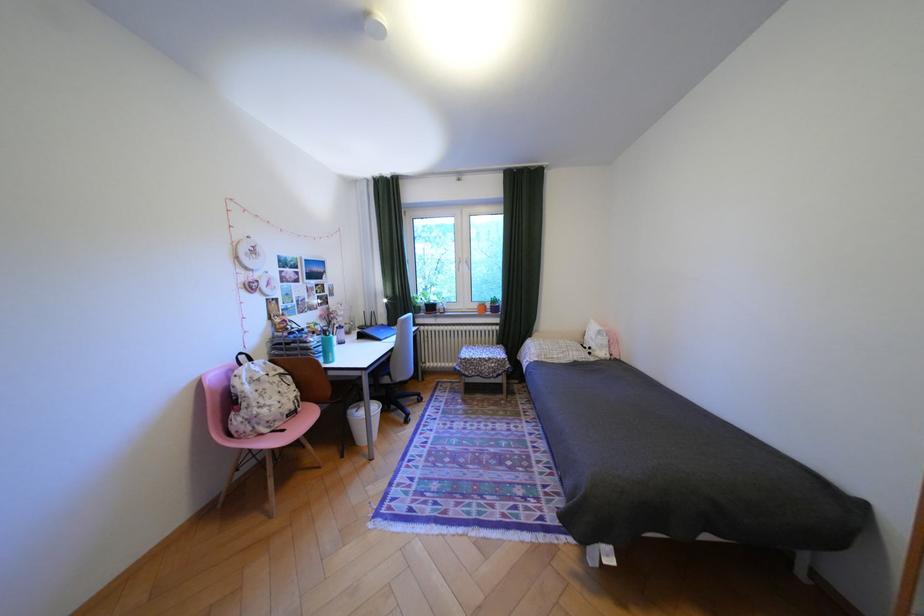
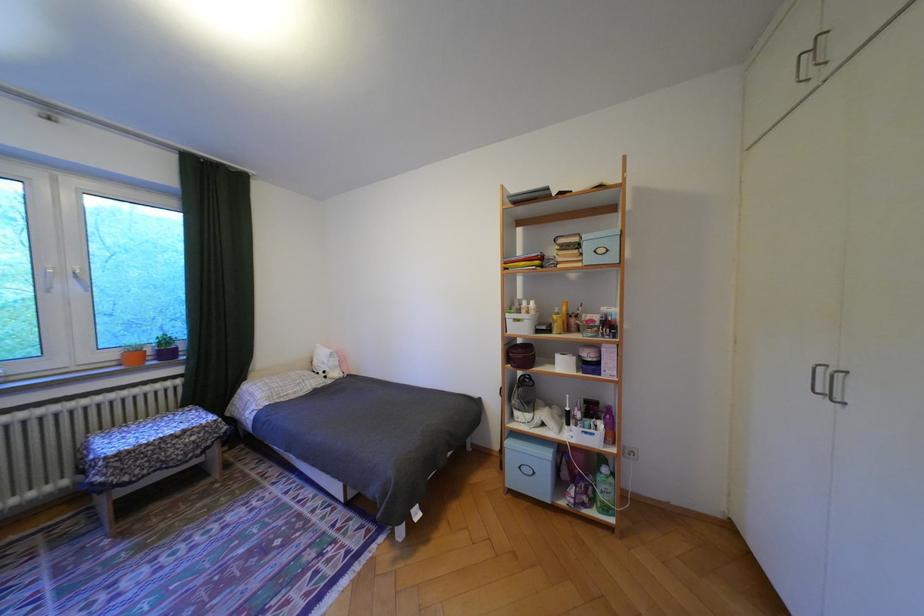
The point at (505, 310) is marked in the first image. Where is the corresponding point in the second image?

(178, 354)